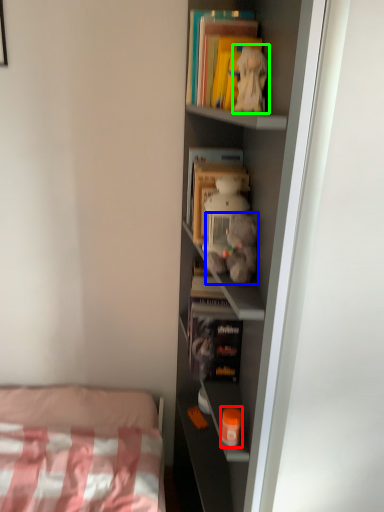
Question: Based on their relative distances, which object is farther from toy (highlighted by a red box)? Choose from toy (highlighted by a blue box) and toy (highlighted by a green box).

Choices:
 (A) toy
 (B) toy

Answer: (B)